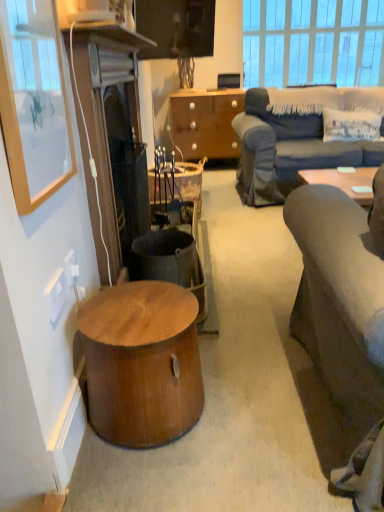
Question: Can you confirm if dark brown wood fireplace at left is shorter than clear glass window at upper center?

Choices:
 (A) no
 (B) yes

Answer: (A)

Question: From the image's perspective, is dark brown wood fireplace at left beneath clear glass window at upper center?

Choices:
 (A) no
 (B) yes

Answer: (B)

Question: Can you confirm if dark brown wood fireplace at left is thinner than clear glass window at upper center?

Choices:
 (A) yes
 (B) no

Answer: (B)

Question: From the image's perspective, is dark brown wood fireplace at left over clear glass window at upper center?

Choices:
 (A) no
 (B) yes

Answer: (A)

Question: Would you say dark brown wood fireplace at left contains clear glass window at upper center?

Choices:
 (A) yes
 (B) no

Answer: (B)

Question: Considering the positions of rustic wood trash bin/can at center and rustic wood desk at center in the image, is rustic wood trash bin/can at center taller or shorter than rustic wood desk at center?

Choices:
 (A) short
 (B) tall

Answer: (A)

Question: Based on their positions, is rustic wood trash bin/can at center located to the left or right of rustic wood desk at center?

Choices:
 (A) right
 (B) left

Answer: (B)

Question: Relative to rustic wood desk at center, is rustic wood trash bin/can at center in front or behind?

Choices:
 (A) behind
 (B) front

Answer: (B)

Question: Would you say rustic wood trash bin/can at center is inside or outside rustic wood desk at center?

Choices:
 (A) outside
 (B) inside

Answer: (A)

Question: Choose the correct answer: Is white plastic power outlet at lower left, placed as the 2th power outlet when sorted from front to back, inside rustic wood desk at center or outside it?

Choices:
 (A) inside
 (B) outside

Answer: (B)

Question: From a real-world perspective, is white plastic power outlet at lower left, positioned as the 1th power outlet in back-to-front order, above or below rustic wood desk at center?

Choices:
 (A) above
 (B) below

Answer: (A)

Question: In terms of width, does white plastic power outlet at lower left, placed as the 2th power outlet when sorted from front to back, look wider or thinner when compared to rustic wood desk at center?

Choices:
 (A) wide
 (B) thin

Answer: (B)

Question: Would you say white plastic power outlet at lower left, positioned as the 1th power outlet in back-to-front order, is to the left or to the right of rustic wood desk at center in the picture?

Choices:
 (A) left
 (B) right

Answer: (A)

Question: From the image's perspective, is dark brown wood fireplace at left located above or below rustic wood trash bin/can at center?

Choices:
 (A) above
 (B) below

Answer: (A)

Question: Does point (115, 103) appear closer or farther from the camera than point (147, 252)?

Choices:
 (A) closer
 (B) farther

Answer: (A)